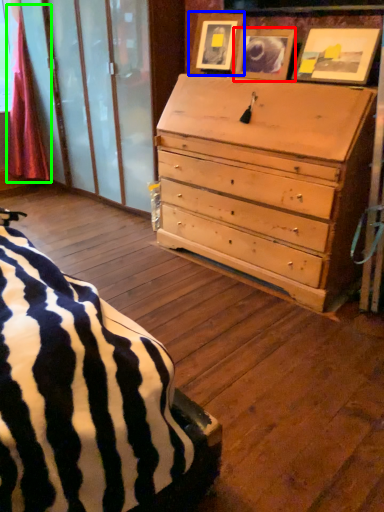
Question: Which object is positioned farthest from picture frame (highlighted by a red box)? Select from picture frame (highlighted by a blue box) and curtain (highlighted by a green box).

Choices:
 (A) picture frame
 (B) curtain

Answer: (B)